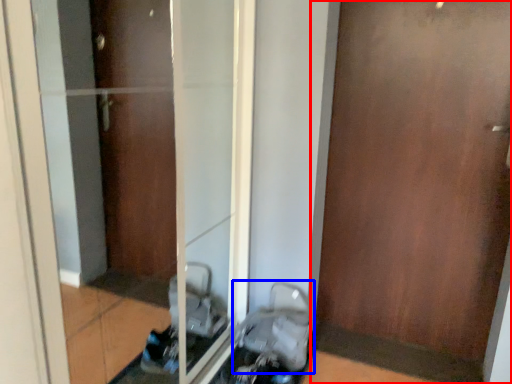
Question: Among these objects, which one is farthest to the camera, door (highlighted by a red box) or baby carriage (highlighted by a blue box)?

Choices:
 (A) door
 (B) baby carriage

Answer: (B)